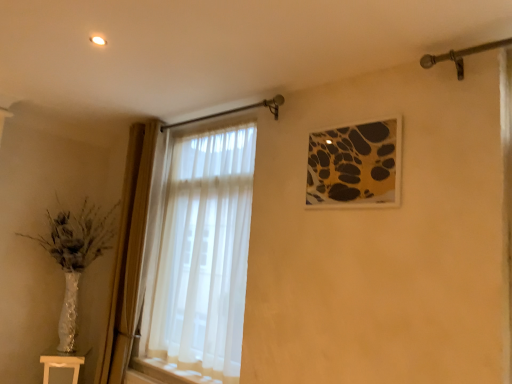
Question: From a real-world perspective, is light wood table at lower left located higher than gold-framed artwork at upper right?

Choices:
 (A) yes
 (B) no

Answer: (B)

Question: Is light wood table at lower left to the left of gold-framed artwork at upper right from the viewer's perspective?

Choices:
 (A) no
 (B) yes

Answer: (B)

Question: Is light wood table at lower left closer to the viewer compared to gold-framed artwork at upper right?

Choices:
 (A) no
 (B) yes

Answer: (A)

Question: Does light wood table at lower left have a greater width compared to gold-framed artwork at upper right?

Choices:
 (A) yes
 (B) no

Answer: (A)

Question: Is light wood table at lower left positioned beyond the bounds of gold-framed artwork at upper right?

Choices:
 (A) yes
 (B) no

Answer: (A)

Question: Considering the relative sizes of light wood table at lower left and gold-framed artwork at upper right in the image provided, is light wood table at lower left smaller than gold-framed artwork at upper right?

Choices:
 (A) yes
 (B) no

Answer: (B)

Question: Is the depth of gold-framed artwork at upper right greater than that of light wood table at lower left?

Choices:
 (A) no
 (B) yes

Answer: (A)

Question: Is gold-framed artwork at upper right aimed at light wood table at lower left?

Choices:
 (A) no
 (B) yes

Answer: (A)

Question: Is gold-framed artwork at upper right located outside light wood table at lower left?

Choices:
 (A) no
 (B) yes

Answer: (B)

Question: From a real-world perspective, is gold-framed artwork at upper right on top of light wood table at lower left?

Choices:
 (A) no
 (B) yes

Answer: (B)

Question: Is gold-framed artwork at upper right shorter than light wood table at lower left?

Choices:
 (A) no
 (B) yes

Answer: (A)

Question: Considering the relative sizes of gold-framed artwork at upper right and light wood table at lower left in the image provided, is gold-framed artwork at upper right smaller than light wood table at lower left?

Choices:
 (A) yes
 (B) no

Answer: (A)

Question: Is gold-framed artwork at upper right taller or shorter than light wood table at lower left?

Choices:
 (A) tall
 (B) short

Answer: (A)